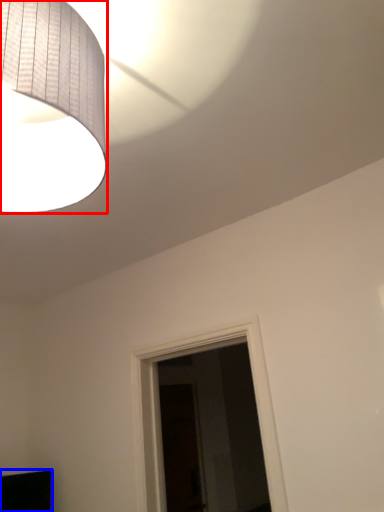
Question: Which object appears farthest to the camera in this image, lamp (highlighted by a red box) or furniture (highlighted by a blue box)?

Choices:
 (A) lamp
 (B) furniture

Answer: (B)